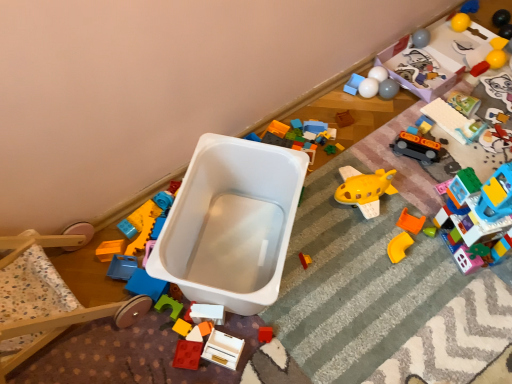
I want to click on white glossy balls at upper right, placed as the eighth toy when sorted from right to left, so click(368, 87).

What do you see at coordinates (344, 119) in the screenshot? The image size is (512, 384). I see `wooden train at center, the 7th toy from the left` at bounding box center [344, 119].

Image resolution: width=512 pixels, height=384 pixels. What do you see at coordinates (470, 6) in the screenshot? I see `blue plastic toy at upper right, positioned as the 16th toy in left-to-right order` at bounding box center [470, 6].

Image resolution: width=512 pixels, height=384 pixels. What do you see at coordinates (453, 121) in the screenshot? I see `rubberized plastic toy car at upper right, marked as the 4th toy in a right-to-left arrangement` at bounding box center [453, 121].

Locate an element on the screen. This screenshot has width=512, height=384. orange plastic train at center, the eleventh toy positioned from the left is located at coordinates pos(416,147).

Is matte gray cat at upper right, which is the fifteenth toy in left-to-right order, positioned with its back to rubberized red brick at lower center, positioned as the fifteenth toy in right-to-left order?

matte gray cat at upper right, which is the fifteenth toy in left-to-right order, is not turned away from rubberized red brick at lower center, positioned as the fifteenth toy in right-to-left order.

Is matte gray cat at upper right, acting as the 2th toy starting from the right, not within rubberized red brick at lower center, positioned as the fifteenth toy in right-to-left order?

Yes, matte gray cat at upper right, acting as the 2th toy starting from the right, is not within rubberized red brick at lower center, positioned as the fifteenth toy in right-to-left order.

What's the angular difference between matte gray cat at upper right, which is the fifteenth toy in left-to-right order, and rubberized red brick at lower center, the 2th toy viewed from the left,'s facing directions?

The facing directions of matte gray cat at upper right, which is the fifteenth toy in left-to-right order, and rubberized red brick at lower center, the 2th toy viewed from the left, are 111 degrees apart.

Does point (490, 86) come closer to viewer compared to point (199, 352)?

No, (490, 86) is behind (199, 352).

Would you say blue plastic toy at upper right, acting as the 1th toy starting from the right, is inside or outside wooden toy box at center, the thirteenth toy positioned from the right?

blue plastic toy at upper right, acting as the 1th toy starting from the right, is located beyond the bounds of wooden toy box at center, the thirteenth toy positioned from the right.

From the image's perspective, who appears lower, blue plastic toy at upper right, acting as the 1th toy starting from the right, or wooden toy box at center, the thirteenth toy positioned from the right?

wooden toy box at center, the thirteenth toy positioned from the right, is shown below in the image.

Considering the sizes of objects blue plastic toy at upper right, positioned as the 16th toy in left-to-right order, and wooden toy box at center, the thirteenth toy positioned from the right, in the image provided, who is bigger, blue plastic toy at upper right, positioned as the 16th toy in left-to-right order, or wooden toy box at center, the thirteenth toy positioned from the right,?

Bigger between the two is wooden toy box at center, the thirteenth toy positioned from the right.

Is white plastic baby carriage at center positioned far away from wooden toy box at center, the thirteenth toy positioned from the right?

That's not correct — white plastic baby carriage at center is a little close to wooden toy box at center, the thirteenth toy positioned from the right.

From a real-world perspective, is white plastic baby carriage at center physically above wooden toy box at center, the thirteenth toy positioned from the right?

Yes, from a real-world perspective, white plastic baby carriage at center is above wooden toy box at center, the thirteenth toy positioned from the right.

Does white plastic baby carriage at center have a larger size compared to wooden toy box at center, the thirteenth toy positioned from the right?

Correct, white plastic baby carriage at center is larger in size than wooden toy box at center, the thirteenth toy positioned from the right.

Is rubberized plastic toy car at upper right, which appears as the thirteenth toy when viewed from the left, wider than orange matte plastic corner piece at lower right, the eighth toy positioned from the left?

Yes.

Is rubberized plastic toy car at upper right, marked as the 4th toy in a right-to-left arrangement, oriented away from orange matte plastic corner piece at lower right, the eighth toy positioned from the left?

rubberized plastic toy car at upper right, marked as the 4th toy in a right-to-left arrangement, is not turned away from orange matte plastic corner piece at lower right, the eighth toy positioned from the left.

Is rubberized plastic toy car at upper right, which appears as the thirteenth toy when viewed from the left, surrounding orange matte plastic corner piece at lower right, the ninth toy positioned from the right?

No, rubberized plastic toy car at upper right, which appears as the thirteenth toy when viewed from the left, does not contain orange matte plastic corner piece at lower right, the ninth toy positioned from the right.

Between orange plastic block at lower right, placed as the 10th toy when sorted from left to right, and translucent plastic building blocks at right, arranged as the 5th toy when viewed from the right, which one has more height?

translucent plastic building blocks at right, arranged as the 5th toy when viewed from the right.

Is translucent plastic building blocks at right, positioned as the 12th toy in left-to-right order, surrounded by orange plastic block at lower right, placed as the 10th toy when sorted from left to right?

No.

Is orange plastic block at lower right, placed as the 10th toy when sorted from left to right, positioned with its back to translucent plastic building blocks at right, arranged as the 5th toy when viewed from the right?

No, orange plastic block at lower right, placed as the 10th toy when sorted from left to right, is not facing away from translucent plastic building blocks at right, arranged as the 5th toy when viewed from the right.

From the picture: Considering the relative sizes of blue plastic toy at upper right, acting as the 1th toy starting from the right, and matte gray cat at upper right, which is the fifteenth toy in left-to-right order, in the image provided, is blue plastic toy at upper right, acting as the 1th toy starting from the right, bigger than matte gray cat at upper right, which is the fifteenth toy in left-to-right order,?

No.

Considering the relative positions of blue plastic toy at upper right, acting as the 1th toy starting from the right, and matte gray cat at upper right, acting as the 2th toy starting from the right, in the image provided, is blue plastic toy at upper right, acting as the 1th toy starting from the right, in front of matte gray cat at upper right, acting as the 2th toy starting from the right,?

No.

From a real-world perspective, starting from the matte gray cat at upper right, acting as the 2th toy starting from the right, which toy is the 1st one below it? Please provide its 2D coordinates.

[(470, 6)]

What's the angular difference between blue plastic toy at upper right, positioned as the 16th toy in left-to-right order, and matte gray cat at upper right, which is the fifteenth toy in left-to-right order,'s facing directions?

blue plastic toy at upper right, positioned as the 16th toy in left-to-right order, and matte gray cat at upper right, which is the fifteenth toy in left-to-right order, are facing 146 degrees away from each other.

Is blue plastic toy at upper right, positioned as the 16th toy in left-to-right order, at the back of orange plastic block at lower right, the 7th toy when ordered from right to left?

orange plastic block at lower right, the 7th toy when ordered from right to left, does not have its back to blue plastic toy at upper right, positioned as the 16th toy in left-to-right order.

Measure the distance from orange plastic block at lower right, the 7th toy when ordered from right to left, to blue plastic toy at upper right, acting as the 1th toy starting from the right.

orange plastic block at lower right, the 7th toy when ordered from right to left, is 1.08 meters away from blue plastic toy at upper right, acting as the 1th toy starting from the right.

How many degrees apart are the facing directions of orange plastic block at lower right, placed as the 10th toy when sorted from left to right, and blue plastic toy at upper right, acting as the 1th toy starting from the right?

The angular difference between orange plastic block at lower right, placed as the 10th toy when sorted from left to right, and blue plastic toy at upper right, acting as the 1th toy starting from the right, is 16.4 degrees.

The height and width of the screenshot is (384, 512). I want to click on the 4th toy positioned below the orange plastic block at lower right, placed as the 10th toy when sorted from left to right (from a real-world perspective), so click(x=470, y=6).

Where is `the 10th toy in front of the matte gray cat at upper right, acting as the 2th toy starting from the right, counting from the anchor's position`? The image size is (512, 384). the 10th toy in front of the matte gray cat at upper right, acting as the 2th toy starting from the right, counting from the anchor's position is located at coordinates (187, 354).

Where is `the 9th toy positioned above the blue plastic toy at upper right, acting as the 1th toy starting from the right (from a real-world perspective)`? the 9th toy positioned above the blue plastic toy at upper right, acting as the 1th toy starting from the right (from a real-world perspective) is located at coordinates (223, 349).

Looking at the image, which one is located closer to matte gray cat at upper right, acting as the 2th toy starting from the right, rubberized red brick at lower center, the 2th toy viewed from the left, or rubberized plastic toy car at upper right, which appears as the thirteenth toy when viewed from the left?

Among the two, rubberized plastic toy car at upper right, which appears as the thirteenth toy when viewed from the left, is located nearer to matte gray cat at upper right, acting as the 2th toy starting from the right.

Looking at the image, which one is located further to wooden bunk bed at left, orange matte plastic corner piece at lower right, the ninth toy positioned from the right, or white plastic baby carriage at center?

orange matte plastic corner piece at lower right, the ninth toy positioned from the right, is further to wooden bunk bed at left.

Based on their spatial positions, is rubberized plastic toy car at upper right, marked as the 4th toy in a right-to-left arrangement, or yellow rubber ball at upper right, the third toy from the right, further from rubberized plastic block at center, the 1th toy positioned from the left?

yellow rubber ball at upper right, the third toy from the right, is positioned further to the anchor rubberized plastic block at center, the 1th toy positioned from the left.

When comparing their distances from blue plastic toy at upper right, positioned as the 16th toy in left-to-right order, does orange plastic block at lower right, placed as the 10th toy when sorted from left to right, or rubberized red brick at lower center, positioned as the fifteenth toy in right-to-left order, seem closer?

Among the two, orange plastic block at lower right, placed as the 10th toy when sorted from left to right, is located nearer to blue plastic toy at upper right, positioned as the 16th toy in left-to-right order.

Looking at this image, based on their spatial positions, is orange plastic block at lower right, placed as the 10th toy when sorted from left to right, or wooden train at center, the 10th toy from the right, closer to white glossy balls at upper right, the ninth toy positioned from the left?

Based on the image, wooden train at center, the 10th toy from the right, appears to be nearer to white glossy balls at upper right, the ninth toy positioned from the left.

Looking at this image, estimate the real-world distances between objects in this image. Which object is closer to orange matte plastic corner piece at lower right, the ninth toy positioned from the right, orange plastic train at center, which ranks as the sixth toy in right-to-left order, or white plastic baby carriage at center?

orange plastic train at center, which ranks as the sixth toy in right-to-left order, is closer to orange matte plastic corner piece at lower right, the ninth toy positioned from the right.

From the image, which object appears to be farther from orange plastic train at center, which ranks as the sixth toy in right-to-left order, white plastic baby carriage at center or matte gray cat at upper right, which is the fifteenth toy in left-to-right order?

Among the two, white plastic baby carriage at center is located further to orange plastic train at center, which ranks as the sixth toy in right-to-left order.

Estimate the real-world distances between objects in this image. Which object is further from white plastic baby carriage at center, orange matte plastic corner piece at lower right, the eighth toy positioned from the left, or orange plastic train at center, which ranks as the sixth toy in right-to-left order?

orange plastic train at center, which ranks as the sixth toy in right-to-left order, is positioned further to the anchor white plastic baby carriage at center.

Where is `baby carriage between blue plastic toy at upper right, acting as the 1th toy starting from the right, and white plastic toy at center, which is the third toy from left to right, in the up-down direction`? The height and width of the screenshot is (384, 512). baby carriage between blue plastic toy at upper right, acting as the 1th toy starting from the right, and white plastic toy at center, which is the third toy from left to right, in the up-down direction is located at coordinates (231, 223).

You are a GUI agent. You are given a task and a screenshot of the screen. Output one action in this format:
    pyautogui.click(x=<x>, y=<y>)
    Task: Click on the baby carriage located between wooden bunk bed at left and wooden train at center, the 10th toy from the right, in the depth direction
    The height and width of the screenshot is (384, 512).
    Given the screenshot: What is the action you would take?
    pyautogui.click(x=231, y=223)

This screenshot has height=384, width=512. Find the location of `baby carriage between wooden bunk bed at left and orange plastic block at lower right, the 7th toy when ordered from right to left, from left to right`. baby carriage between wooden bunk bed at left and orange plastic block at lower right, the 7th toy when ordered from right to left, from left to right is located at coordinates (231, 223).

What are the coordinates of `baby carriage between rubberized plastic block at center, the 1th toy positioned from the left, and orange plastic block at lower right, placed as the 10th toy when sorted from left to right` in the screenshot? It's located at (231, 223).